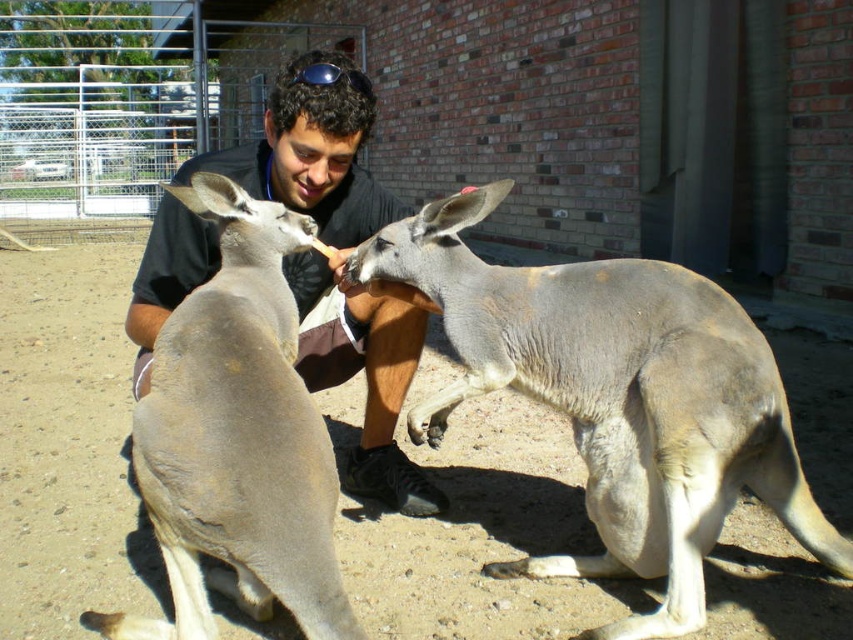
Question: Which object is closer to the camera taking this photo?

Choices:
 (A) smooth black shirt at center
 (B) gray matte kangaroo at center
 (C) gray fur kangaroo at center

Answer: (B)

Question: Does gray matte kangaroo at center come in front of sunglasses at center?

Choices:
 (A) no
 (B) yes

Answer: (B)

Question: From the image, what is the correct spatial relationship of smooth black shirt at center in relation to sunglasses at center?

Choices:
 (A) left
 (B) right

Answer: (A)

Question: Is gray matte kangaroo at center wider than smooth black shirt at center?

Choices:
 (A) no
 (B) yes

Answer: (A)

Question: Which object appears farthest from the camera in this image?

Choices:
 (A) sunglasses at center
 (B) gray matte kangaroo at center
 (C) smooth black shirt at center
 (D) gray fur kangaroo at center

Answer: (C)

Question: Which object is farther from the camera taking this photo?

Choices:
 (A) gray fur kangaroo at center
 (B) smooth black shirt at center
 (C) sunglasses at center
 (D) gray matte kangaroo at center

Answer: (B)